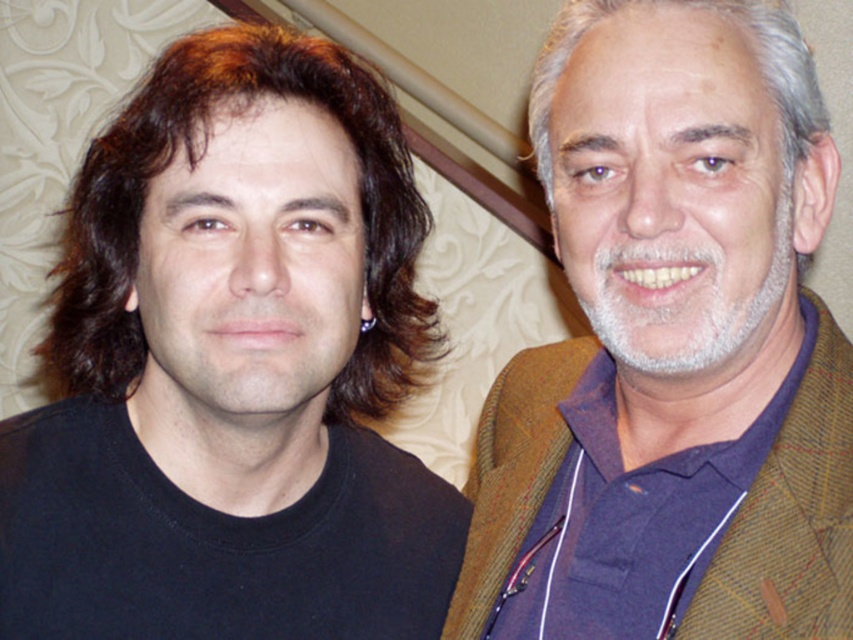
You are a tailor measuring for a jacket. You need to determine if the brown woolen jacket at right can be shortened to fit the brownshinyhair at left. Can it be adjusted based on their heights?

The brown woolen jacket at right is taller than brownshinyhair at left, so it can be shortened to fit them.

You are a tailor measuring for a new jacket. You see the brown woolen jacket at right and the brownshinyhair at left. Which item has a smaller width?

The brown woolen jacket at right has a lesser width compared to the brownshinyhair at left, so the brown woolen jacket at right is smaller in width.

You are a photographer trying to capture a group photo of two people. You notice the brown woolen jacket at right and the brownshinyhair at left in the frame. Which object is located to the right of the other?

The brown woolen jacket at right is positioned on the right side of brownshinyhair at left.